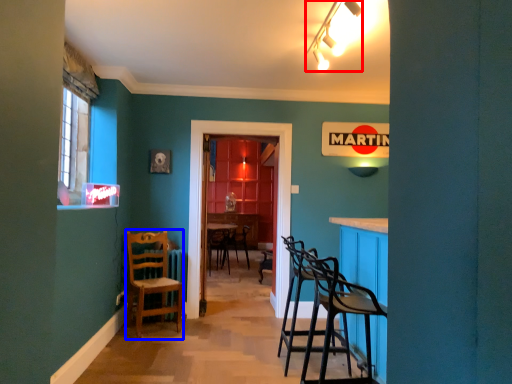
Question: Among these objects, which one is nearest to the camera, lamp (highlighted by a red box) or chair (highlighted by a blue box)?

Choices:
 (A) lamp
 (B) chair

Answer: (A)